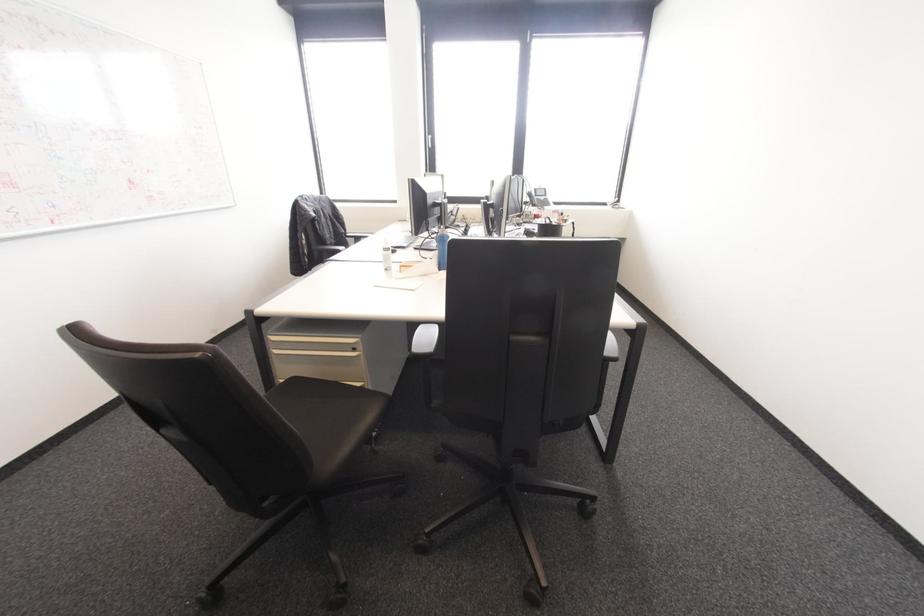
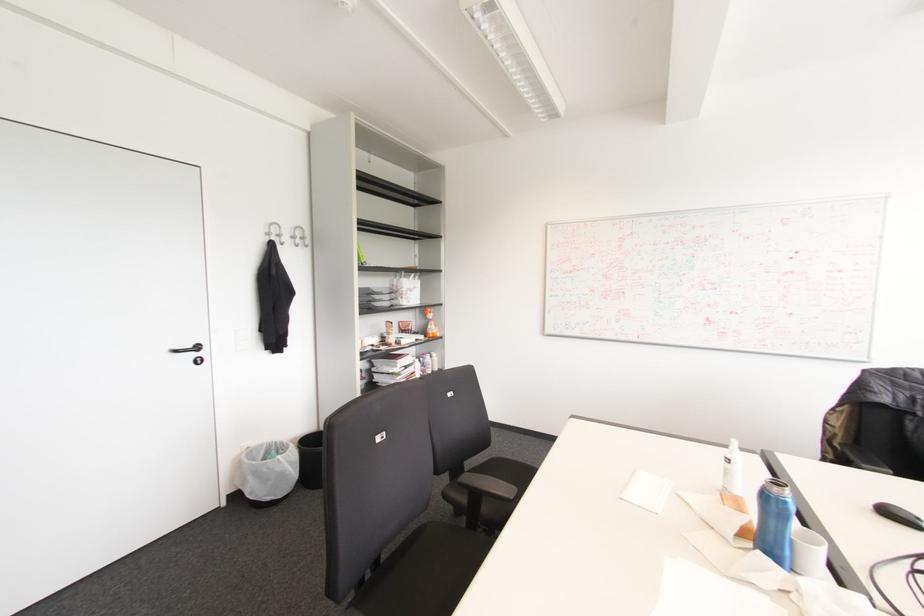
Where in the second image is the point corresponding to (440,270) from the first image?

(757, 554)